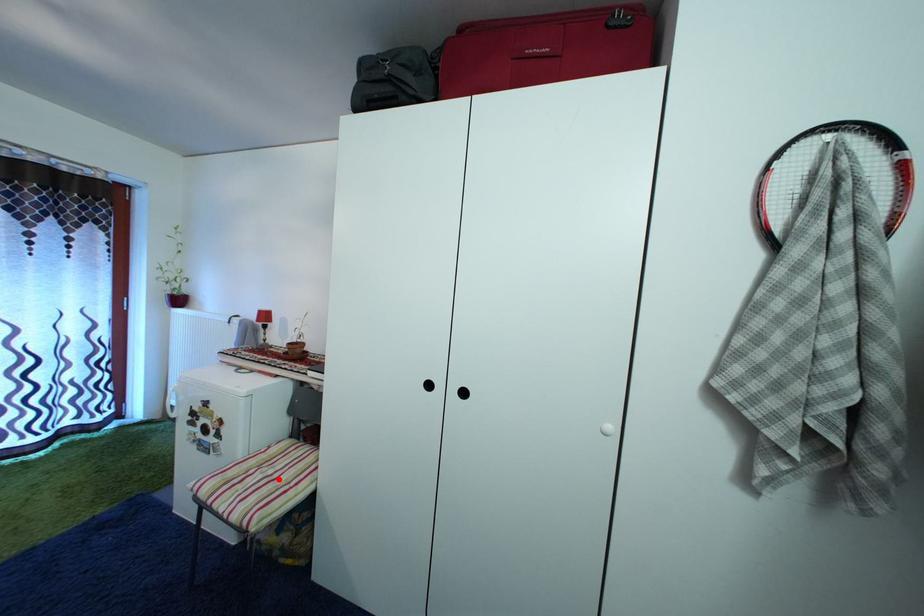
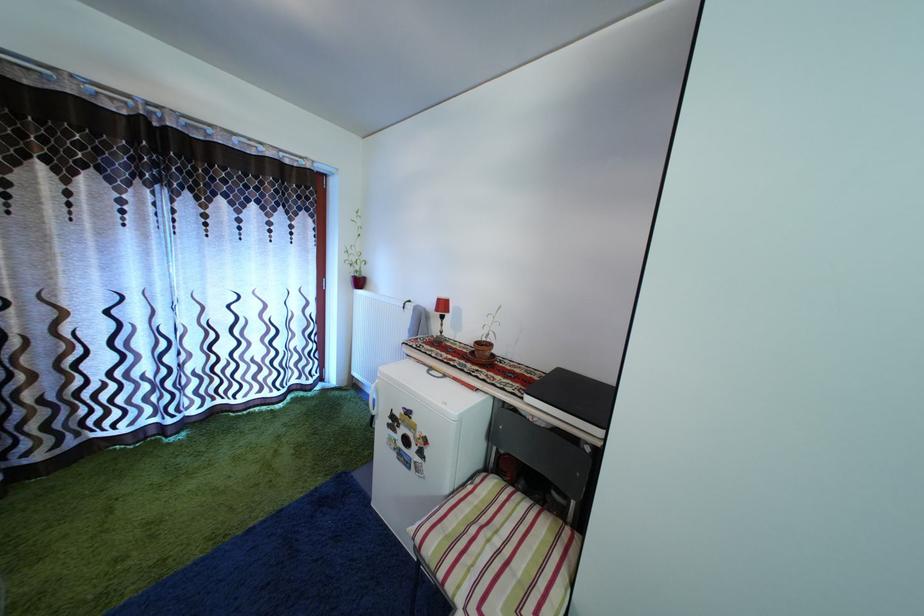
Where in the second image is the point corresponding to the highlighted location from the first image?

(505, 549)